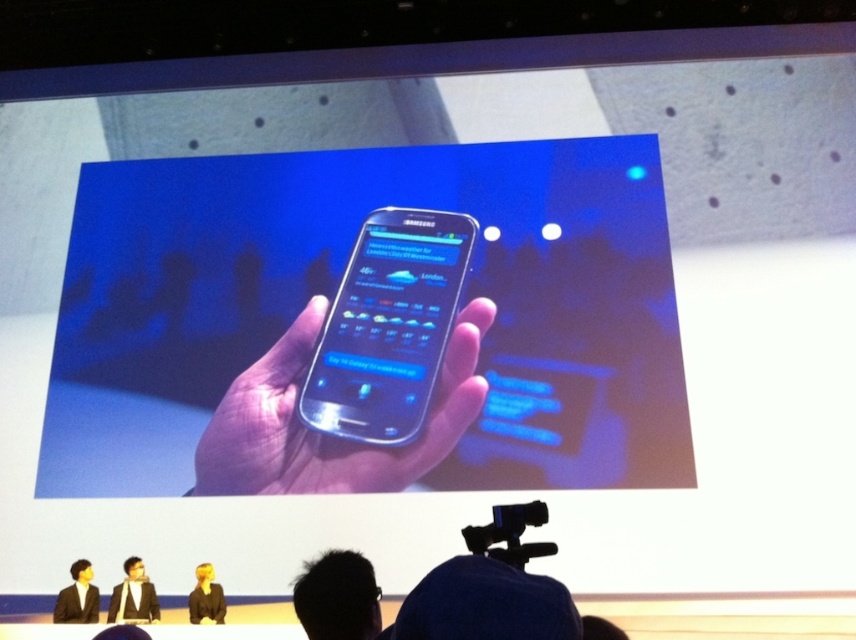
Can you confirm if sleek metallic phone at center is wider than black plastic video camera at lower center?

Correct, the width of sleek metallic phone at center exceeds that of black plastic video camera at lower center.

Where is `sleek metallic phone at center`? The height and width of the screenshot is (640, 856). sleek metallic phone at center is located at coordinates (388, 326).

Does point (437, 365) come closer to viewer compared to point (530, 509)?

No, (437, 365) is further to viewer.

The width and height of the screenshot is (856, 640). Find the location of `sleek metallic phone at center`. sleek metallic phone at center is located at coordinates tap(388, 326).

Is sleek metallic phone at center wider than dark suit at center?

Correct, the width of sleek metallic phone at center exceeds that of dark suit at center.

Looking at this image, who is more forward, (x=391, y=397) or (x=70, y=598)?

Point (x=70, y=598) is in front.

Image resolution: width=856 pixels, height=640 pixels. Identify the location of sleek metallic phone at center. (388, 326).

Who is shorter, dark suit at center or black suit at lower center?

Standing shorter between the two is black suit at lower center.

Is dark suit at center below black suit at lower center?

No.

Who is more forward, [81,572] or [201,605]?

Positioned in front is point [201,605].

Locate an element on the screen. dark suit at center is located at coordinates (76, 596).